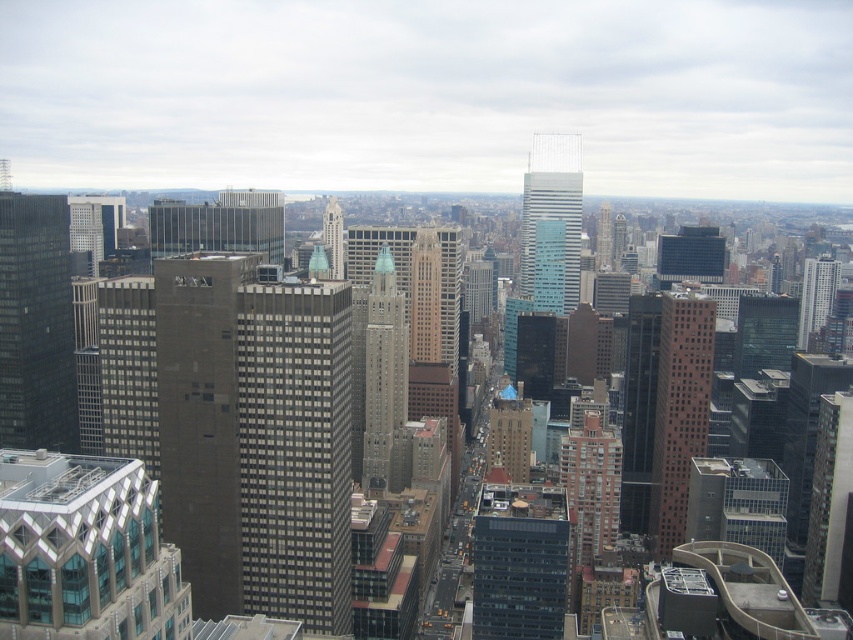
Question: Which object is the closest to the matte glass building at center?

Choices:
 (A) teal glass skyscraper at center
 (B) gray glass skyscraper at center
 (C) white glass building at upper right

Answer: (B)

Question: Among these points, which one is nearest to the camera?

Choices:
 (A) (186, 214)
 (B) (566, 237)
 (C) (115, 243)
 (D) (302, 388)

Answer: (D)

Question: Does matte glass building at center have a lesser width compared to gray glass skyscraper at center?

Choices:
 (A) no
 (B) yes

Answer: (A)

Question: Can you confirm if dark gray glass skyscraper at left is bigger than white glass building at upper right?

Choices:
 (A) no
 (B) yes

Answer: (B)

Question: Which of the following is the farthest from the observer?

Choices:
 (A) matte glass skyscraper at left
 (B) dark gray glass skyscraper at left
 (C) geometric glass skyscraper at lower left

Answer: (A)

Question: From the image, what is the correct spatial relationship of matte glass building at center in relation to white glass building at upper right?

Choices:
 (A) left
 (B) right

Answer: (A)